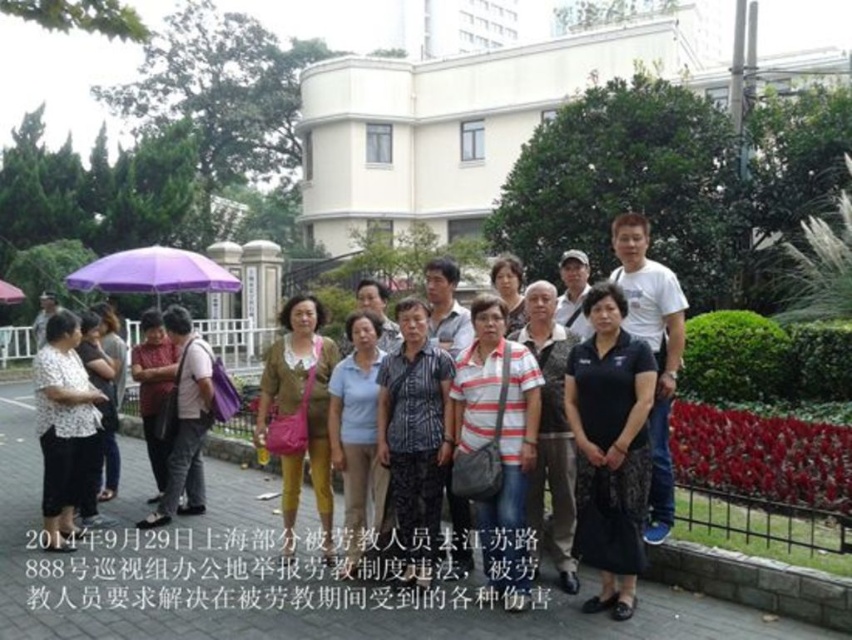
You are a photographer standing at the center of the paved area. You want to take a photo that includes both the white printed blouse at lower left and the blue cotton shirt at center. Given that your camera has a maximum focal length that allows capturing objects up to 40 feet apart, will you be able to include both in the same frame?

The white printed blouse at lower left is 38.34 feet from the blue cotton shirt at center, which is within the camera maximum focal length of 40 feet. Therefore, you can include both in the same frame.

You are a photographer trying to capture a clear shot of both the black fabric dress at center and the striped cotton shirt at center. Since you want to ensure both are visible in the frame, which clothing item should you focus on first to account for their size difference?

The black fabric dress at center is taller than the striped cotton shirt at center, so you should focus on the black fabric dress at center first to ensure it fits within the frame, then adjust for the smaller striped cotton shirt at center.

You are a photographer standing at the camera position. You want to take a closeup shot of the white printed blouse at lower left. Considering the distance, can you capture it clearly without moving closer?

The white printed blouse at lower left is 31.00 meters away from the camera. At this distance, capturing a clear closeup shot would require a telephoto lens with sufficient zoom capability to avoid moving closer.